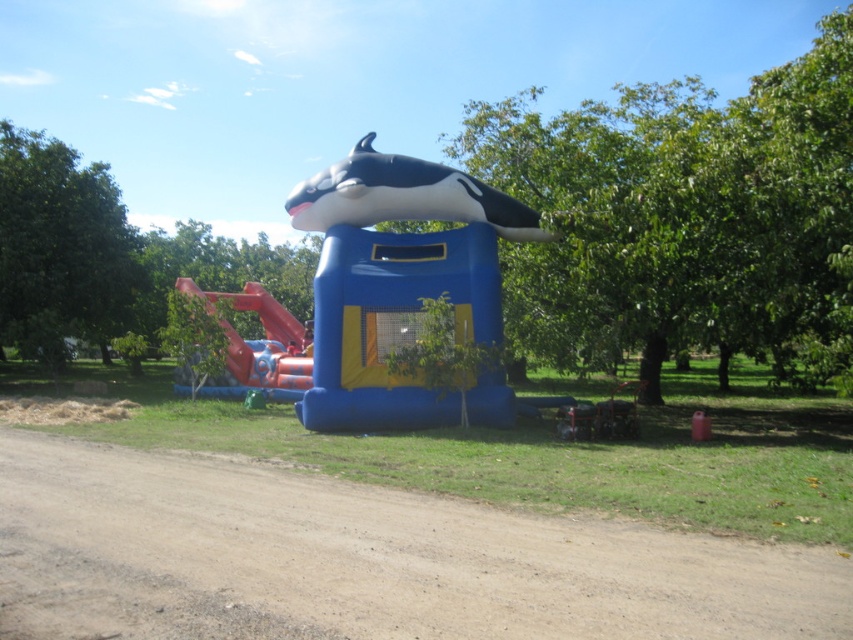
Who is positioned more to the left, black matte whale at center or orange matte slide at center?

Positioned to the left is orange matte slide at center.

Is black matte whale at center to the left of orange matte slide at center from the viewer's perspective?

No, black matte whale at center is not to the left of orange matte slide at center.

Is point (509, 236) less distant than point (285, 369)?

Yes, it is.

Where is `black matte whale at center`? black matte whale at center is located at coordinates (404, 196).